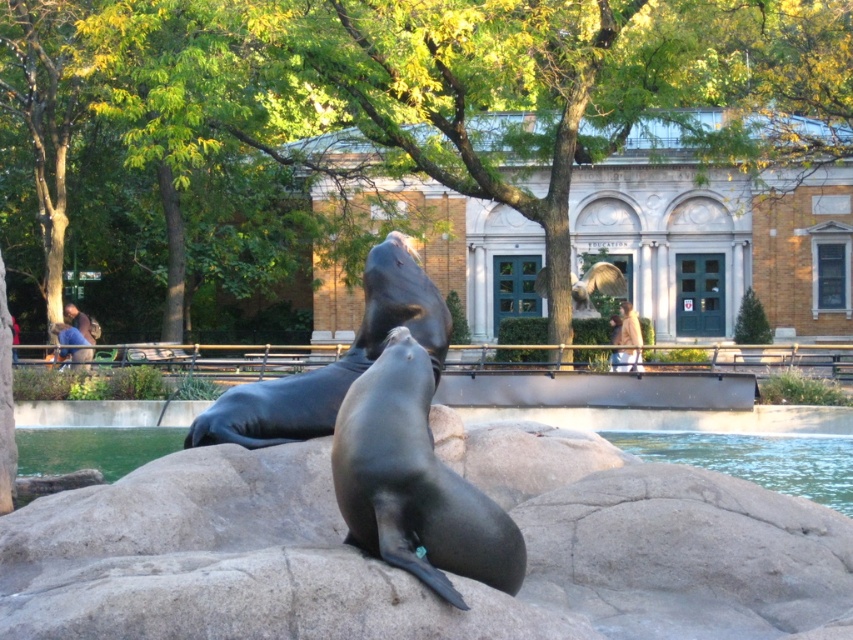
Who is positioned more to the right, shiny black seal at center or black rubber seal at center?

black rubber seal at center

From the picture: Who is lower down, shiny black seal at center or black rubber seal at center?

Positioned lower is black rubber seal at center.

Does point (376, 348) lie behind point (109, 432)?

No, (376, 348) is closer to viewer.

Image resolution: width=853 pixels, height=640 pixels. In order to click on shiny black seal at center in this screenshot , I will do `click(334, 362)`.